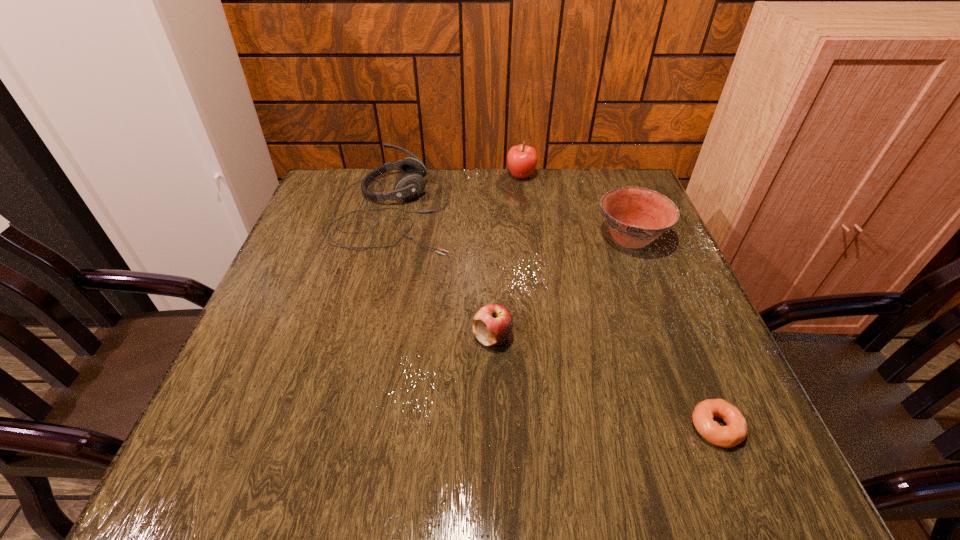
Image resolution: width=960 pixels, height=540 pixels. I want to click on free space located 0.070m on the left of the bowl, so [x=566, y=238].

The image size is (960, 540). Identify the location of vacant space positioned on the back of the second nearest object. coord(491,246).

I want to click on blank area located on the back of the shortest object, so click(x=692, y=371).

Find the location of a particular element. Image resolution: width=960 pixels, height=540 pixels. apple present at the far edge is located at coordinates (521, 159).

Identify the location of headset that is at the far edge. Image resolution: width=960 pixels, height=540 pixels. (410, 185).

Locate an element on the screen. bowl present at the far edge is located at coordinates (636, 216).

Where is `object that is at the near edge`? object that is at the near edge is located at coordinates (736, 429).

The width and height of the screenshot is (960, 540). I want to click on object that is positioned at the left edge, so click(410, 185).

What are the coordinates of `bowl positioned at the right edge` in the screenshot? It's located at (636, 216).

Locate an element on the screen. This screenshot has width=960, height=540. doughnut present at the right edge is located at coordinates (736, 429).